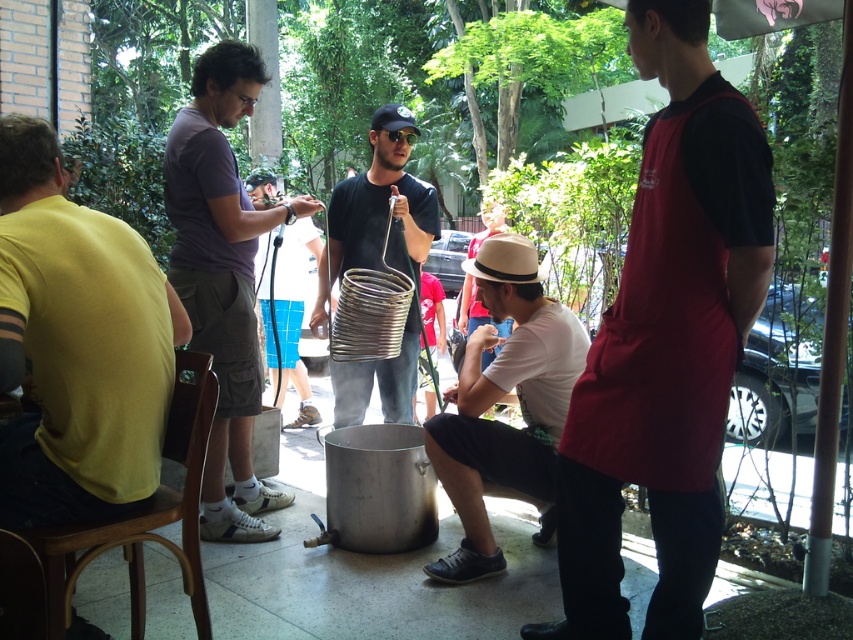
Question: Is white cotton shirt at lower center thinner than shiny metallic spiral at center?

Choices:
 (A) no
 (B) yes

Answer: (A)

Question: Which object appears closest to the camera in this image?

Choices:
 (A) black matte apron at right
 (B) white cotton shirt at lower center
 (C) matte black shirt at center
 (D) yellow cotton shirt at left

Answer: (D)

Question: Is black matte apron at right positioned before matte black shirt at center?

Choices:
 (A) yes
 (B) no

Answer: (A)

Question: Which point is closer to the camera?

Choices:
 (A) white cotton shirt at lower center
 (B) yellow cotton shirt at left

Answer: (B)

Question: Which point is farther from the camera taking this photo?

Choices:
 (A) (387, 202)
 (B) (682, 419)

Answer: (A)

Question: Does black matte apron at right have a greater width compared to dark purple shirt at left?

Choices:
 (A) yes
 (B) no

Answer: (B)